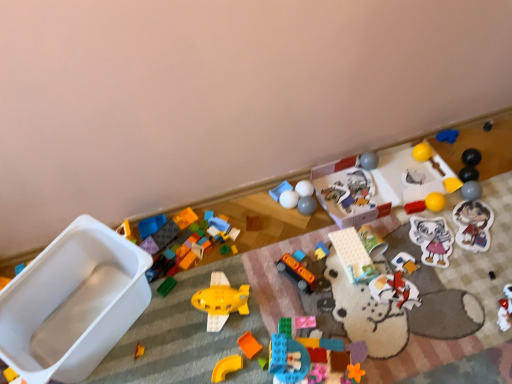
Where is `free space in front of white matte figure at center, the nineteenth toy viewed from the left`? This screenshot has width=512, height=384. free space in front of white matte figure at center, the nineteenth toy viewed from the left is located at coordinates (411, 335).